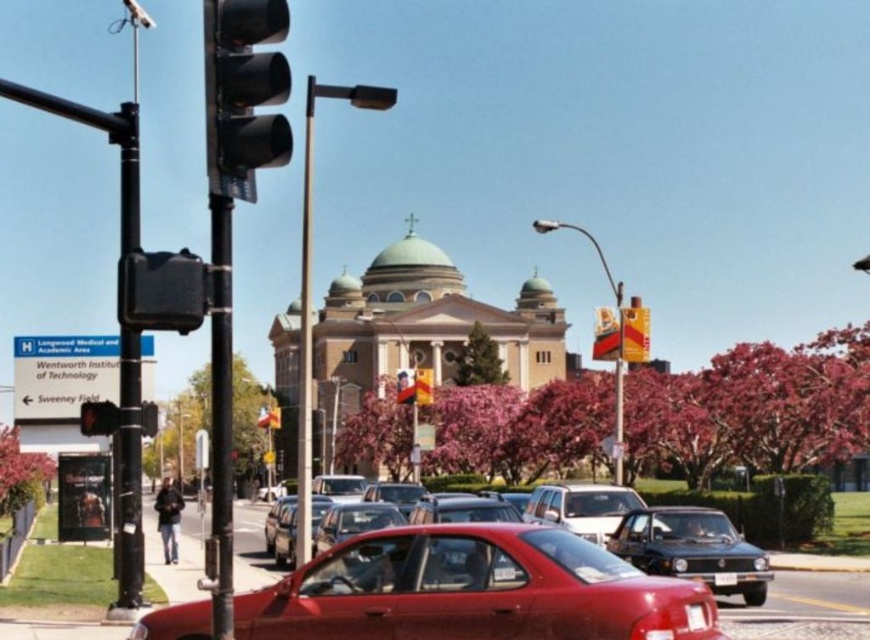
Which is more to the right, black matte traffic light at left or black plastic traffic light at left?

black matte traffic light at left

Does black matte traffic light at left have a lesser height compared to black plastic traffic light at left?

No, black matte traffic light at left is not shorter than black plastic traffic light at left.

This screenshot has height=640, width=870. Describe the element at coordinates (243, 92) in the screenshot. I see `black matte traffic light at left` at that location.

Where is `black matte traffic light at left`? This screenshot has width=870, height=640. black matte traffic light at left is located at coordinates (243, 92).

Is shiny red sedan at center in front of black plastic traffic light at left?

No.

Which of these two, shiny red sedan at center or black plastic traffic light at left, stands shorter?

black plastic traffic light at left is shorter.

Which is behind, point (667, 516) or point (98, 410)?

The point (667, 516) is behind.

Locate an element on the screen. shiny red sedan at center is located at coordinates (664, 538).

Between shiny red sedan at center and shiny black sedan at center, which one appears on the right side from the viewer's perspective?

shiny black sedan at center is more to the right.

Does shiny red sedan at center appear on the left side of shiny black sedan at center?

Yes, shiny red sedan at center is to the left of shiny black sedan at center.

I want to click on shiny red sedan at center, so click(664, 538).